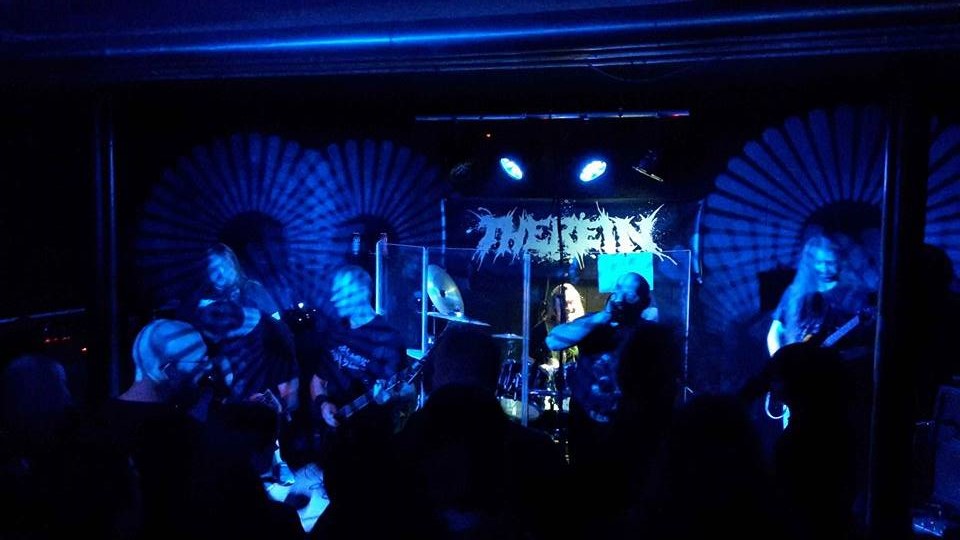
Where is `shoe`? The width and height of the screenshot is (960, 540). shoe is located at coordinates (283, 475).